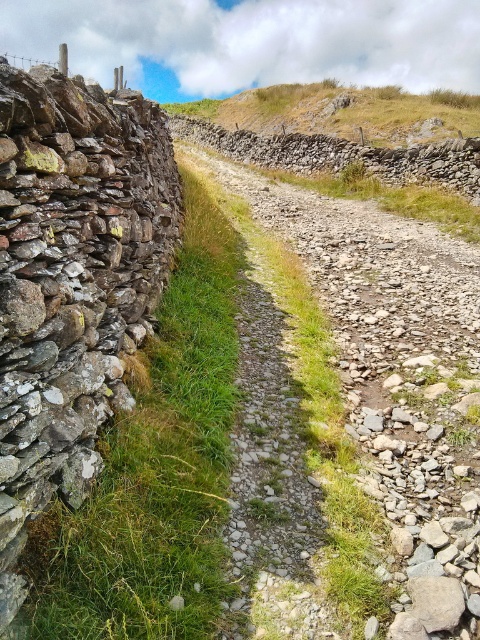
Question: Which object appears closest to the camera in this image?

Choices:
 (A) grassy hillside at upper center
 (B) green grass at left

Answer: (B)

Question: Which is farther from the green grass at left?

Choices:
 (A) grassy hillside at upper center
 (B) gravel path at center

Answer: (A)

Question: Does gravel path at center have a lesser width compared to green grass at left?

Choices:
 (A) yes
 (B) no

Answer: (B)

Question: Among these points, which one is nearest to the camera?

Choices:
 (A) (466, 392)
 (B) (183, 186)

Answer: (A)

Question: From the image, what is the correct spatial relationship of gravel path at center in relation to green grass at left?

Choices:
 (A) below
 (B) above

Answer: (B)

Question: Where is gravel path at center located in relation to grassy hillside at upper center in the image?

Choices:
 (A) left
 (B) right

Answer: (A)